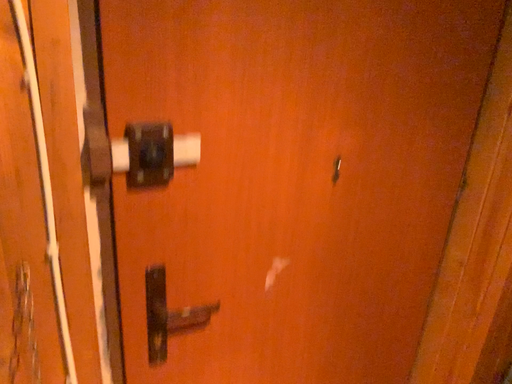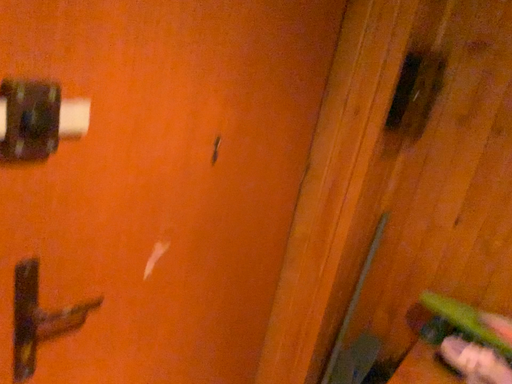
Question: Which way did the camera rotate in the video?

Choices:
 (A) rotated left
 (B) rotated right

Answer: (B)